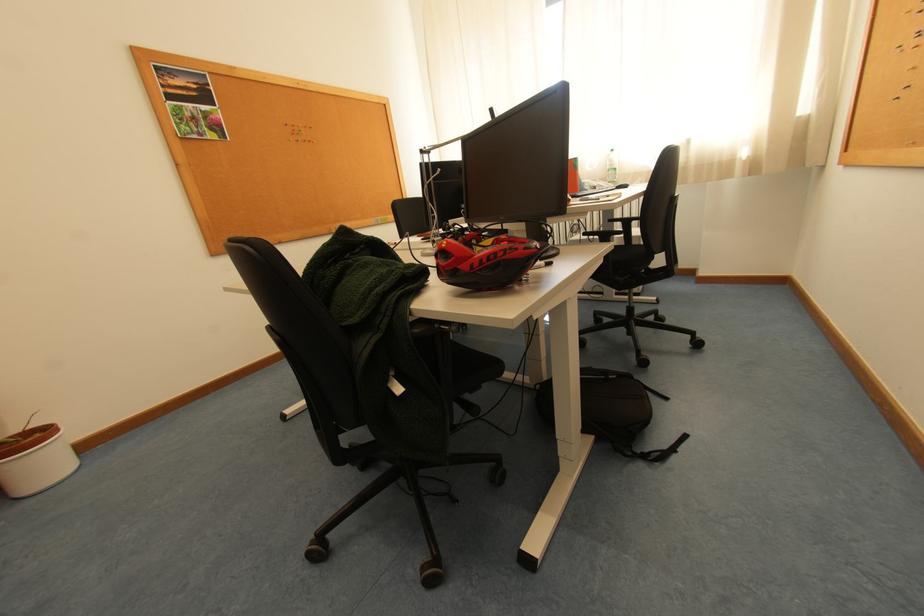
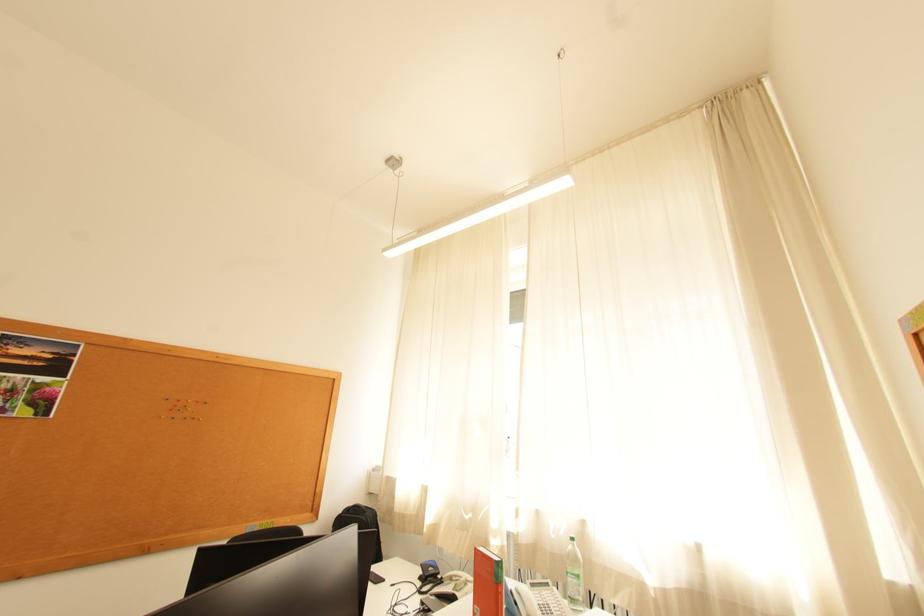
In the second image, find the point that corresponds to [304,134] in the first image.

(186, 408)